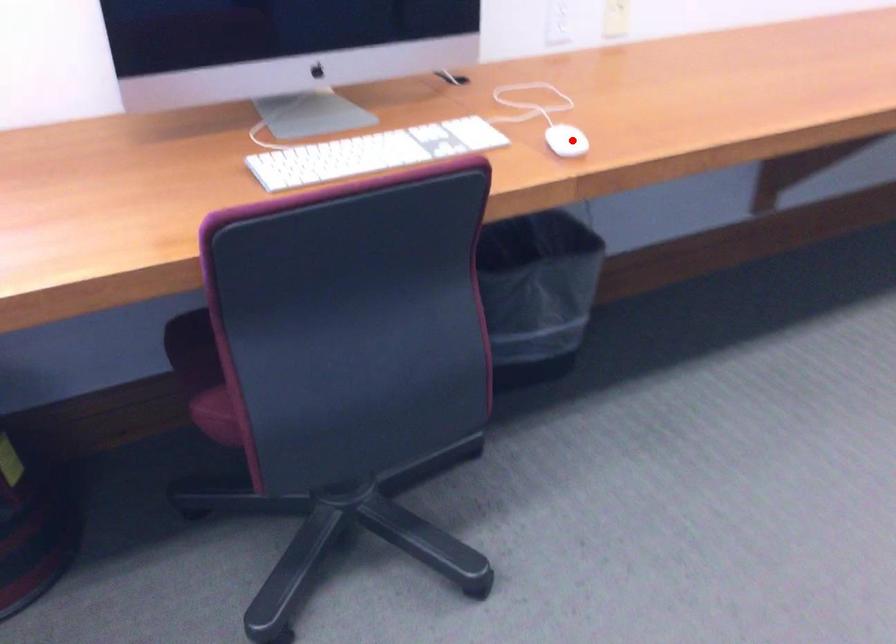
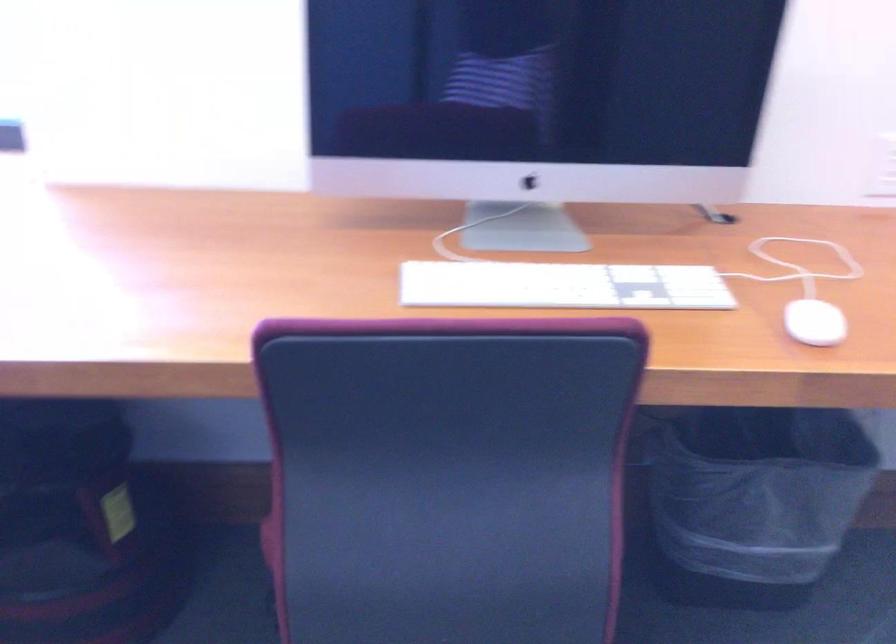
Question: I am providing you with two images of the same scene from different viewpoints. In image1, a red point is highlighted. Considering the same 3D point in image2, which of the following is correct?

Choices:
 (A) It is closer
 (B) It is farther

Answer: (A)